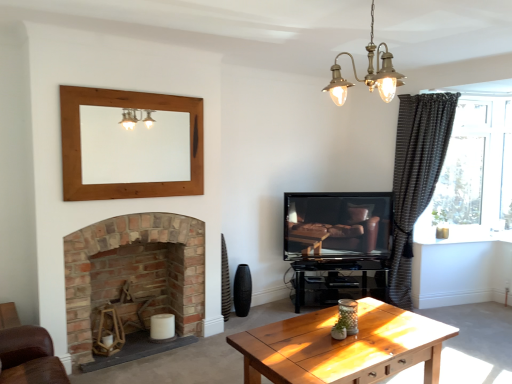
Question: Is brass/textured chandelier at upper center at the right side of dark grey textured curtain at right?

Choices:
 (A) no
 (B) yes

Answer: (A)

Question: Is brass/textured chandelier at upper center not near dark grey textured curtain at right?

Choices:
 (A) no
 (B) yes

Answer: (B)

Question: Does brass/textured chandelier at upper center have a lesser width compared to dark grey textured curtain at right?

Choices:
 (A) yes
 (B) no

Answer: (A)

Question: Does brass/textured chandelier at upper center have a smaller size compared to dark grey textured curtain at right?

Choices:
 (A) no
 (B) yes

Answer: (B)

Question: From a real-world perspective, is brass/textured chandelier at upper center beneath dark grey textured curtain at right?

Choices:
 (A) yes
 (B) no

Answer: (B)

Question: Can dark grey textured curtain at right be found inside brass/textured chandelier at upper center?

Choices:
 (A) no
 (B) yes

Answer: (A)

Question: From a real-world perspective, is brass/textured chandelier at upper center on matte black tv at center?

Choices:
 (A) yes
 (B) no

Answer: (A)

Question: Are brass/textured chandelier at upper center and matte black tv at center located far from each other?

Choices:
 (A) no
 (B) yes

Answer: (B)

Question: Does brass/textured chandelier at upper center appear on the left side of matte black tv at center?

Choices:
 (A) yes
 (B) no

Answer: (A)

Question: Can you confirm if brass/textured chandelier at upper center is shorter than matte black tv at center?

Choices:
 (A) no
 (B) yes

Answer: (B)

Question: Is brass/textured chandelier at upper center taller than matte black tv at center?

Choices:
 (A) yes
 (B) no

Answer: (B)

Question: Is brass/textured chandelier at upper center positioned behind matte black tv at center?

Choices:
 (A) no
 (B) yes

Answer: (A)

Question: Does wooden mirror at upper center contain brass/textured chandelier at upper center?

Choices:
 (A) no
 (B) yes

Answer: (A)